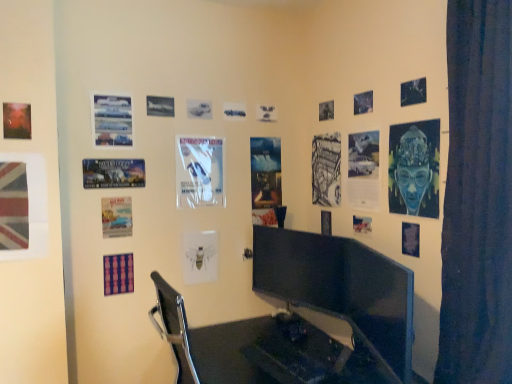
Question: Is white paper at center, the 10th poster page from the right, outside black glossy monitor at center, acting as the 2th computer monitor starting from the front?

Choices:
 (A) yes
 (B) no

Answer: (A)

Question: Is black glossy monitor at center, which appears as the second computer monitor when viewed from the right, surrounded by white paper at center, the 10th poster page from the right?

Choices:
 (A) yes
 (B) no

Answer: (B)

Question: Is white paper at center, the 8th poster page positioned from the left, in front of black glossy monitor at center, placed as the first computer monitor when sorted from back to front?

Choices:
 (A) no
 (B) yes

Answer: (A)

Question: Considering the relative sizes of white paper at center, the 10th poster page from the right, and black glossy monitor at center, which appears as the second computer monitor when viewed from the right, in the image provided, is white paper at center, the 10th poster page from the right, taller than black glossy monitor at center, which appears as the second computer monitor when viewed from the right,?

Choices:
 (A) no
 (B) yes

Answer: (A)

Question: From the image's perspective, is white paper at center, the 10th poster page from the right, below black glossy monitor at center, which appears as the 1th computer monitor when viewed from the left?

Choices:
 (A) yes
 (B) no

Answer: (B)

Question: Is white paper at center, the 8th poster page positioned from the left, positioned behind black glossy monitor at center, which appears as the second computer monitor when viewed from the right?

Choices:
 (A) no
 (B) yes

Answer: (B)

Question: Can you confirm if purple fabric poster at lower left, positioned as the twelfth poster page in right-to-left order, is bigger than glossy plastic poster at upper center, arranged as the 11th poster page when viewed from the left?

Choices:
 (A) no
 (B) yes

Answer: (B)

Question: Is purple fabric poster at lower left, positioned as the twelfth poster page in right-to-left order, not close to glossy plastic poster at upper center, arranged as the 11th poster page when viewed from the left?

Choices:
 (A) no
 (B) yes

Answer: (B)

Question: Does purple fabric poster at lower left, positioned as the twelfth poster page in right-to-left order, have a lesser width compared to glossy plastic poster at upper center, arranged as the 11th poster page when viewed from the left?

Choices:
 (A) yes
 (B) no

Answer: (B)

Question: Is the depth of purple fabric poster at lower left, positioned as the twelfth poster page in right-to-left order, greater than that of glossy plastic poster at upper center, arranged as the 11th poster page when viewed from the left?

Choices:
 (A) yes
 (B) no

Answer: (B)

Question: From the image's perspective, is purple fabric poster at lower left, which appears as the sixth poster page when viewed from the left, above glossy plastic poster at upper center, arranged as the 11th poster page when viewed from the left?

Choices:
 (A) no
 (B) yes

Answer: (A)

Question: From the image's perspective, does purple fabric poster at lower left, positioned as the twelfth poster page in right-to-left order, appear lower than glossy plastic poster at upper center, arranged as the 11th poster page when viewed from the left?

Choices:
 (A) yes
 (B) no

Answer: (A)

Question: Does white glossy poster at center, acting as the 9th poster page starting from the left, appear on the right side of blue textured fabric at upper right, the sixteenth poster page positioned from the left?

Choices:
 (A) yes
 (B) no

Answer: (B)